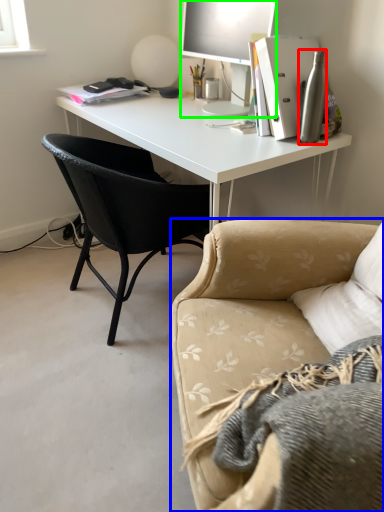
Question: Based on their relative distances, which object is farther from bottle (highlighted by a red box)? Choose from studio couch (highlighted by a blue box) and television (highlighted by a green box).

Choices:
 (A) studio couch
 (B) television

Answer: (A)